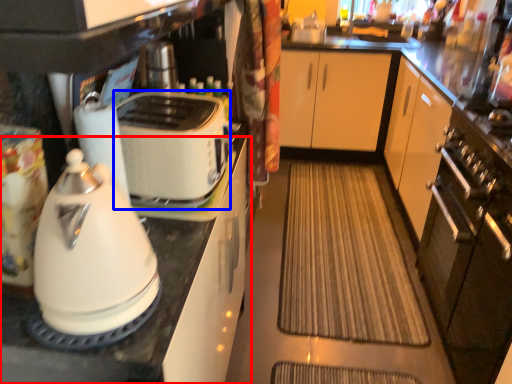
Question: Which point is closer to the camera, cabinetry (highlighted by a red box) or toaster (highlighted by a blue box)?

Choices:
 (A) cabinetry
 (B) toaster

Answer: (A)